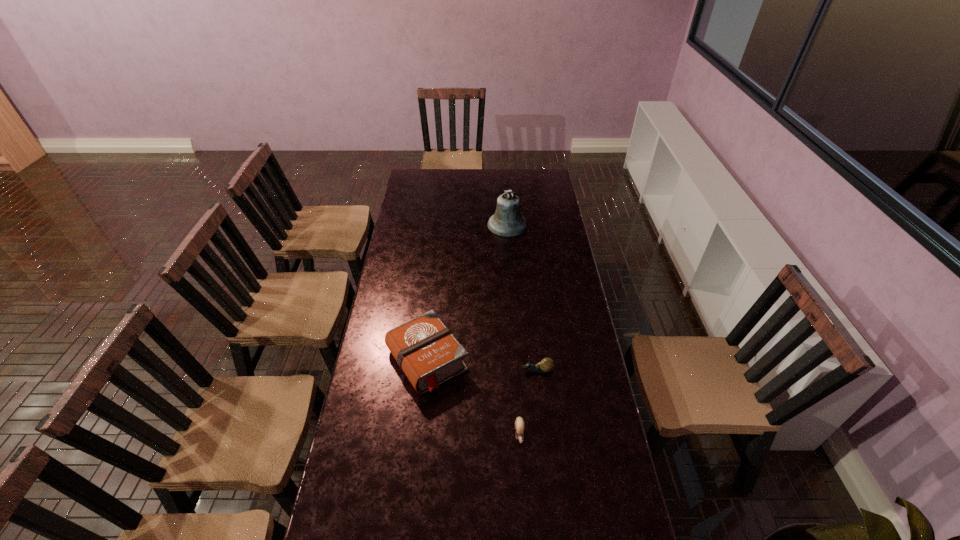
Locate an element on the screen. the second closest object relative to the farther escargot is located at coordinates (426, 350).

Locate which object ranks in proximity to the second tallest object. Please provide its 2D coordinates. Your answer should be formatted as a tuple, i.e. [(x, y)], where the tuple contains the x and y coordinates of a point satisfying the conditions above.

[(519, 422)]

The width and height of the screenshot is (960, 540). In order to click on vacant area that satisfies the following two spatial constraints: 1. on the front-facing side of the taller escargot; 2. on the front-facing side of the nearest object in this screenshot , I will do (545, 434).

The height and width of the screenshot is (540, 960). In order to click on vacant space that satisfies the following two spatial constraints: 1. on the front-facing side of the right escargot; 2. on the front-facing side of the nearer escargot in this screenshot , I will do pos(545,434).

This screenshot has width=960, height=540. What are the coordinates of `free space in the image that satisfies the following two spatial constraints: 1. on the front-facing side of the third tallest object; 2. on the front-facing side of the nearer escargot` in the screenshot? It's located at (545, 434).

Locate an element on the screen. Image resolution: width=960 pixels, height=540 pixels. free space that satisfies the following two spatial constraints: 1. on the back side of the Bible; 2. on the left side of the bell is located at coordinates (442, 225).

Find the location of a particular element. The image size is (960, 540). vacant position in the image that satisfies the following two spatial constraints: 1. on the front-facing side of the third tallest object; 2. on the front-facing side of the nearest object is located at coordinates (545, 434).